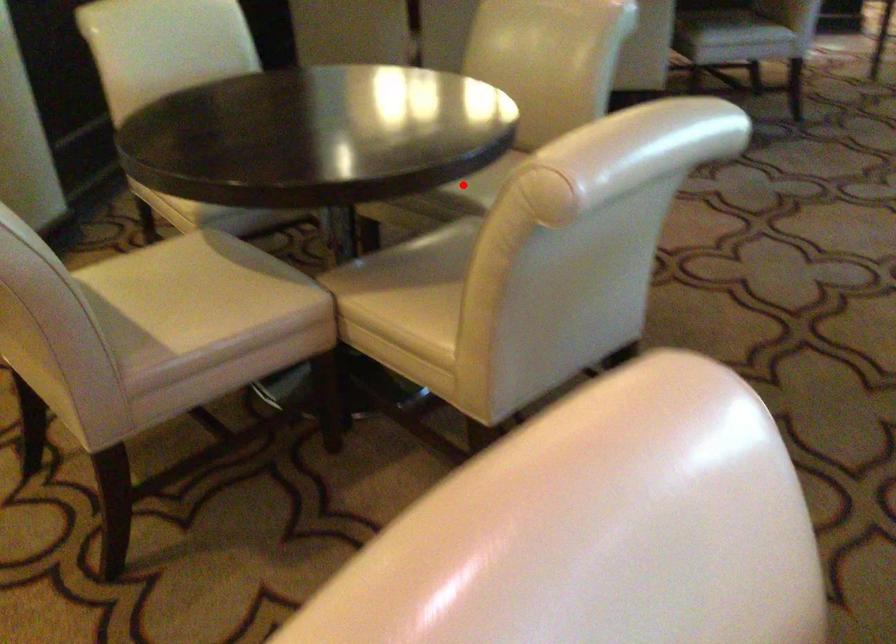
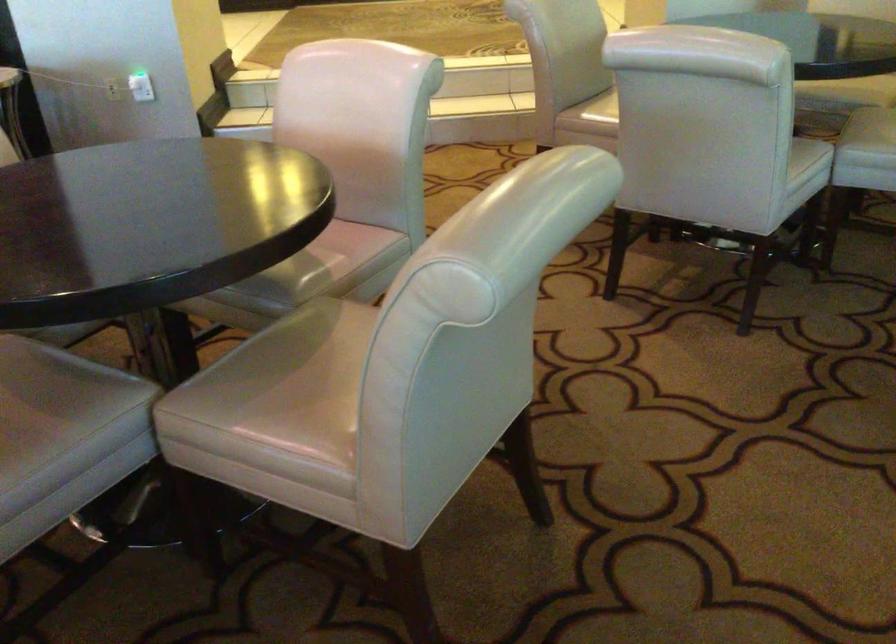
Question: A red point is marked in image1. In image2, is the corresponding 3D point closer to the camera or farther? Reply with the corresponding letter.

Choices:
 (A) The corresponding 3D point is closer.
 (B) The corresponding 3D point is farther.

Answer: (B)